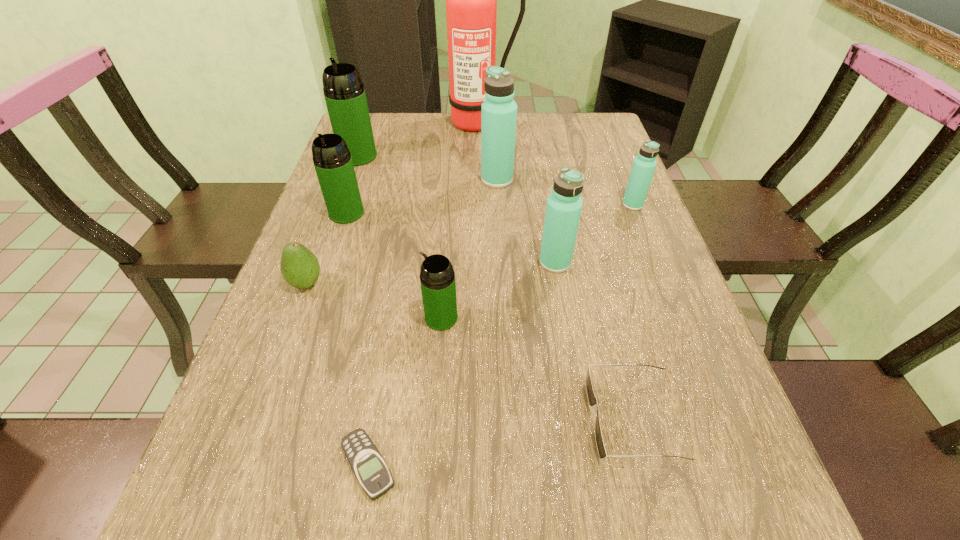
Where is `the rightmost object`? the rightmost object is located at coordinates (644, 165).

This screenshot has height=540, width=960. In order to click on the smallest green thermos bottle in this screenshot , I will do pos(437,278).

Where is `the rightmost green thermos bottle`? This screenshot has width=960, height=540. the rightmost green thermos bottle is located at coordinates (437, 278).

What are the coordinates of `the third shortest object` in the screenshot? It's located at (300, 268).

Locate an element on the screen. Image resolution: width=960 pixels, height=540 pixels. sunglasses is located at coordinates (592, 400).

Locate an element on the screen. gray beeper is located at coordinates (368, 465).

This screenshot has height=540, width=960. I want to click on beeper, so click(x=368, y=465).

Locate an element on the screen. free location located 0.290m on the handle side of the fire extinguisher is located at coordinates (477, 187).

Where is `vacant area situated from the spout of the second farthest object`? The width and height of the screenshot is (960, 540). vacant area situated from the spout of the second farthest object is located at coordinates (341, 204).

This screenshot has height=540, width=960. I want to click on free location located on the back of the leftmost aqua thermos bottle, so click(x=495, y=136).